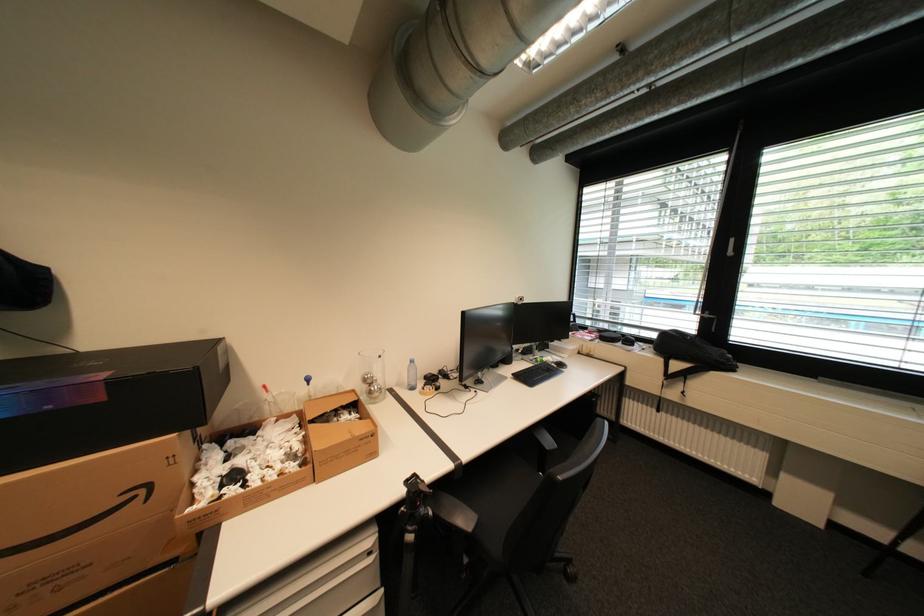
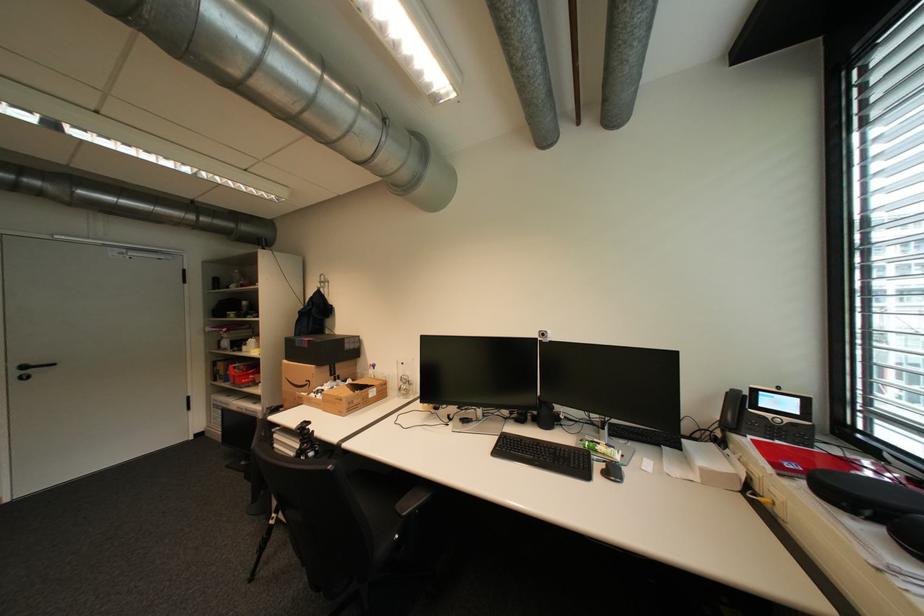
The point at [151,491] is marked in the first image. Where is the corresponding point in the second image?

(317, 383)